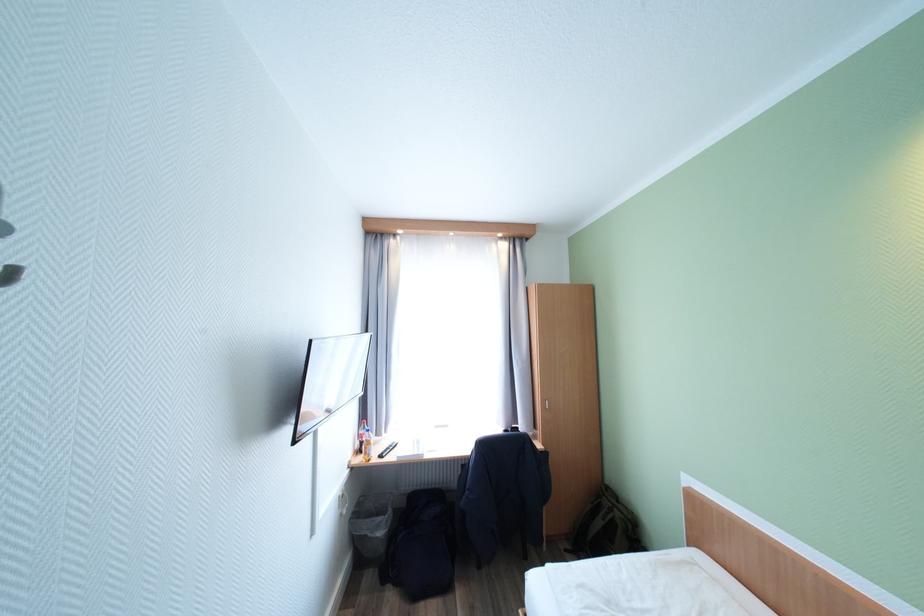
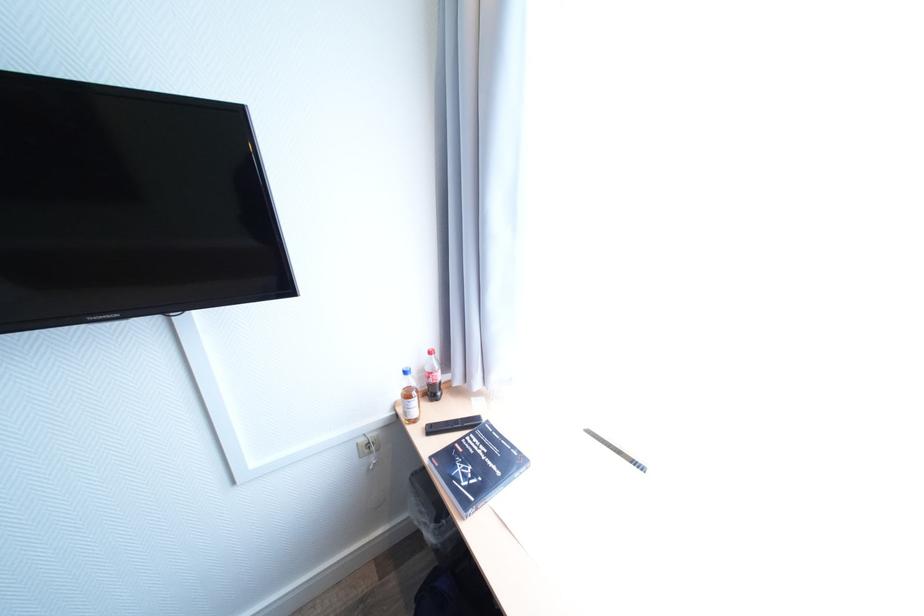
Find the pixel in the second image that matches point (357, 463) in the first image.

(403, 403)